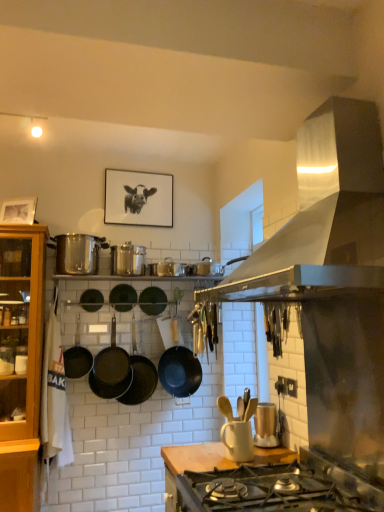
The width and height of the screenshot is (384, 512). In order to click on empty space that is ontop of black matte picture frame at upper center (from a real-world perspective) in this screenshot , I will do `click(148, 168)`.